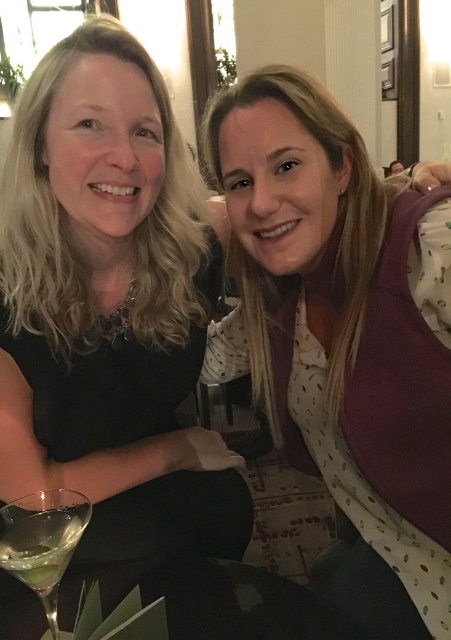
Is matte black dress at center shorter than clear glass martini at lower left?

No.

Does matte black dress at center appear on the right side of clear glass martini at lower left?

No, matte black dress at center is not to the right of clear glass martini at lower left.

Locate an element on the screen. Image resolution: width=451 pixels, height=640 pixels. matte black dress at center is located at coordinates (110, 307).

Locate an element on the screen. matte black dress at center is located at coordinates (110, 307).

Between matte black dress at center and white dotted shirt at center, which one appears on the right side from the viewer's perspective?

Positioned to the right is white dotted shirt at center.

Can you confirm if matte black dress at center is shorter than white dotted shirt at center?

No, matte black dress at center is not shorter than white dotted shirt at center.

Who is more forward, (92, 122) or (396, 512)?

Positioned in front is point (92, 122).

Find the location of a particular element. matte black dress at center is located at coordinates (110, 307).

Between point (392, 396) and point (14, 557), which one is positioned behind?

Positioned behind is point (392, 396).

Is white dotted shirt at center below clear glass martini at lower left?

No, white dotted shirt at center is not below clear glass martini at lower left.

Where is `white dotted shirt at center`? white dotted shirt at center is located at coordinates (344, 332).

Where is `white dotted shirt at center`? The height and width of the screenshot is (640, 451). white dotted shirt at center is located at coordinates (344, 332).